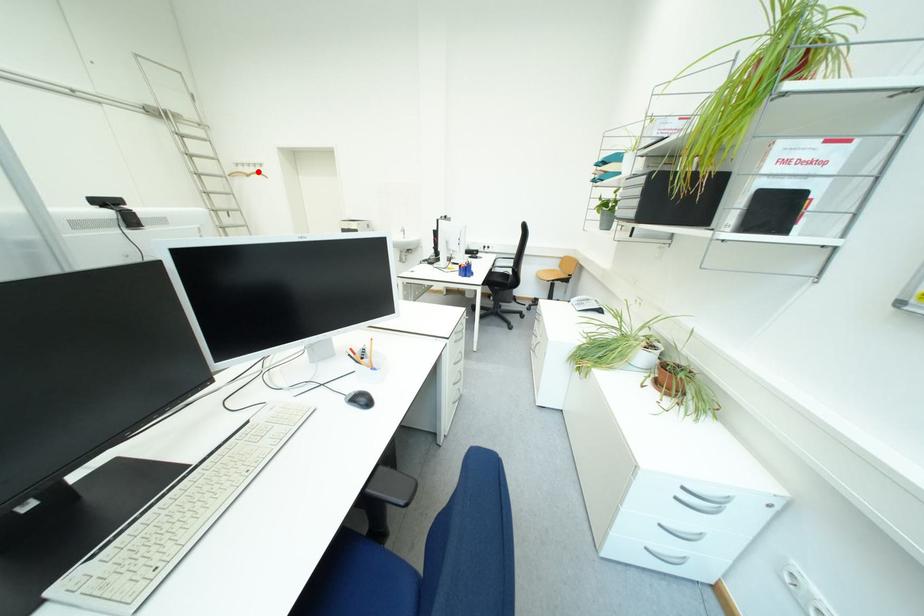
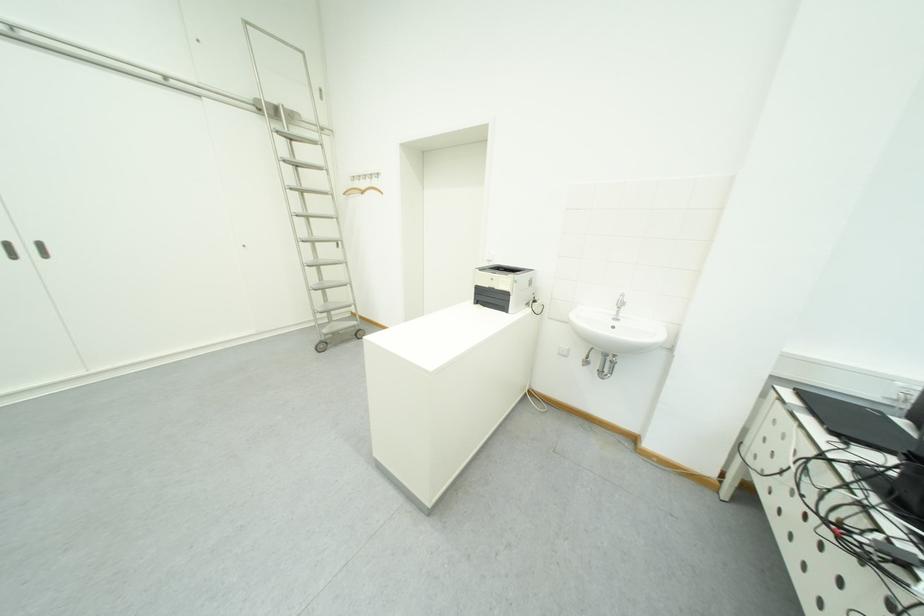
In the second image, find the point that corresponds to the highlighted location in the first image.

(372, 185)